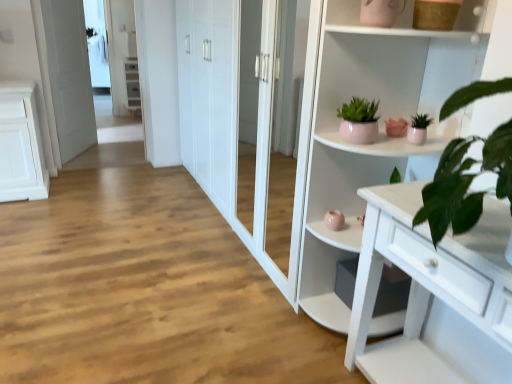
Question: From a real-world perspective, is matte pink pot at upper center, which appears as the 2th houseplant when viewed from the right, physically below white glossy cupboard at upper right?

Choices:
 (A) yes
 (B) no

Answer: (B)

Question: Is matte pink pot at upper center, the 1th houseplant from the left, behind white glossy cupboard at upper right?

Choices:
 (A) yes
 (B) no

Answer: (A)

Question: Is matte pink pot at upper center, the 1th houseplant from the left, far away from white glossy cupboard at upper right?

Choices:
 (A) yes
 (B) no

Answer: (B)

Question: Does matte pink pot at upper center, which appears as the 2th houseplant when viewed from the right, have a lesser height compared to white glossy cupboard at upper right?

Choices:
 (A) yes
 (B) no

Answer: (A)

Question: From the image's perspective, does matte pink pot at upper center, the 1th houseplant from the left, appear lower than white glossy cupboard at upper right?

Choices:
 (A) yes
 (B) no

Answer: (B)

Question: Is matte pink pot at upper center, which appears as the 2th houseplant when viewed from the right, not inside white glossy cupboard at upper right?

Choices:
 (A) yes
 (B) no

Answer: (B)

Question: Can you confirm if white glossy door at left is bigger than white glossy cabinet at upper left?

Choices:
 (A) no
 (B) yes

Answer: (B)

Question: Considering the relative positions of white glossy door at left and white glossy cabinet at upper left in the image provided, is white glossy door at left to the left of white glossy cabinet at upper left from the viewer's perspective?

Choices:
 (A) yes
 (B) no

Answer: (A)

Question: Is white glossy door at left shorter than white glossy cabinet at upper left?

Choices:
 (A) yes
 (B) no

Answer: (B)

Question: Considering the relative sizes of white glossy door at left and white glossy cabinet at upper left in the image provided, is white glossy door at left thinner than white glossy cabinet at upper left?

Choices:
 (A) yes
 (B) no

Answer: (A)

Question: Can you confirm if white glossy door at left is wider than white glossy cabinet at upper left?

Choices:
 (A) no
 (B) yes

Answer: (A)

Question: From a real-world perspective, is white glossy door at left below white glossy cabinet at upper left?

Choices:
 (A) yes
 (B) no

Answer: (B)

Question: Is white glossy cabinet at upper left to the right of white glossy cupboard at upper right from the viewer's perspective?

Choices:
 (A) no
 (B) yes

Answer: (A)